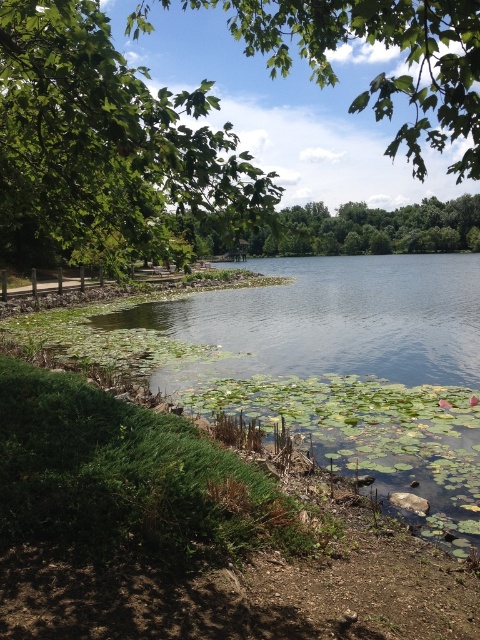
Does green leafy tree at upper center have a greater height compared to green leafy tree at center?

Yes, green leafy tree at upper center is taller than green leafy tree at center.

Which is more to the left, green leafy tree at upper center or green leafy tree at center?

green leafy tree at upper center

Which is behind, point (428, 81) or point (464, 240)?

The point (464, 240) is more distant.

Where is `green leafy tree at upper center`? green leafy tree at upper center is located at coordinates (383, 72).

Between green leafy tree at upper left and green leafy tree at upper center, which one appears on the left side from the viewer's perspective?

green leafy tree at upper left is more to the left.

Can you confirm if green leafy tree at upper left is positioned to the left of green leafy tree at upper center?

Indeed, green leafy tree at upper left is positioned on the left side of green leafy tree at upper center.

Describe the element at coordinates (106, 148) in the screenshot. I see `green leafy tree at upper left` at that location.

Locate an element on the screen. The height and width of the screenshot is (640, 480). green leafy tree at upper left is located at coordinates (106, 148).

Is green leafy tree at upper left closer to camera compared to green leafy tree at center?

Yes, green leafy tree at upper left is in front of green leafy tree at center.

Does green leafy tree at upper left appear on the left side of green leafy tree at center?

Indeed, green leafy tree at upper left is positioned on the left side of green leafy tree at center.

Does point (23, 28) come behind point (416, 237)?

No, (23, 28) is in front of (416, 237).

This screenshot has height=640, width=480. Identify the location of green leafy tree at upper left. (106, 148).